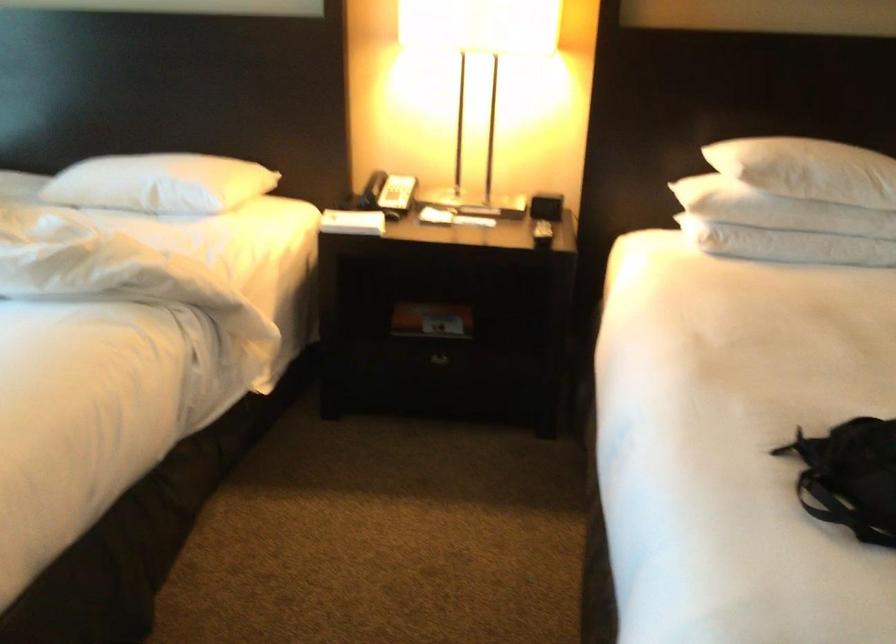
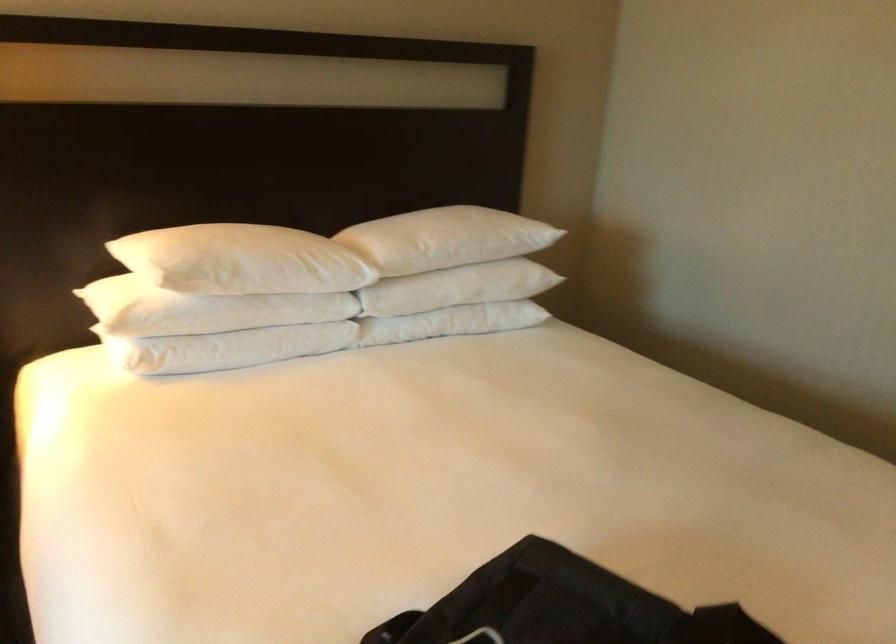
The point at (782, 153) is marked in the first image. Where is the corresponding point in the second image?

(211, 254)